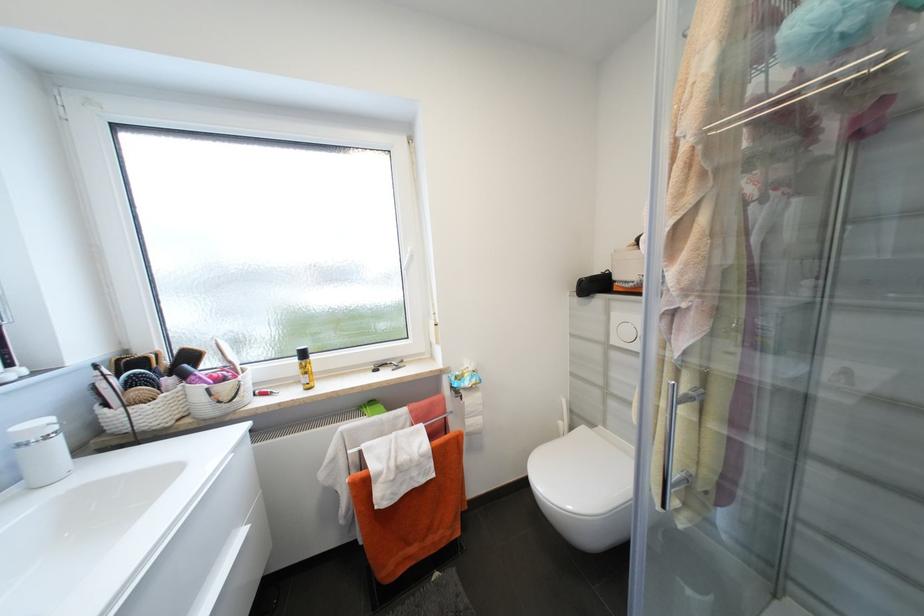
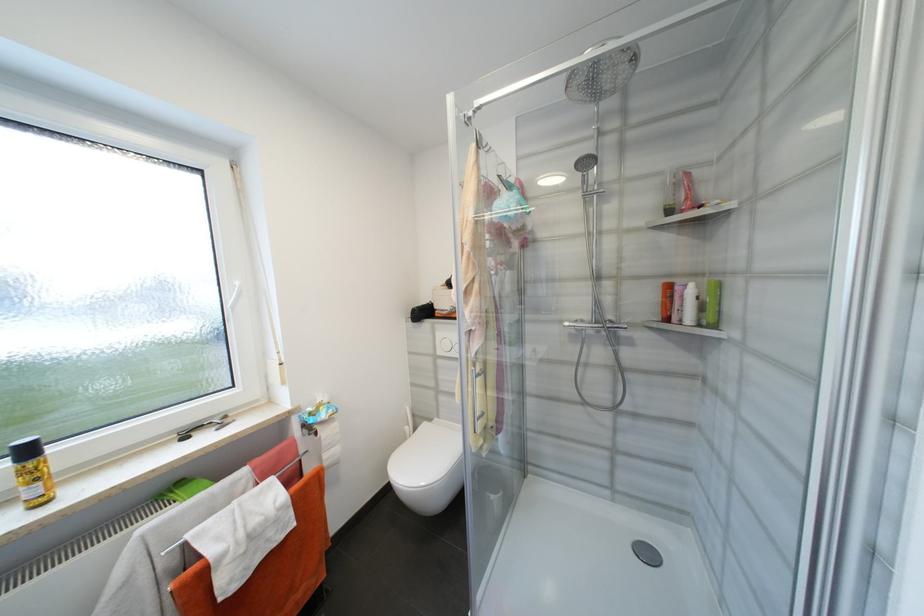
In the second image, find the point that corresponds to point 468,399 in the first image.

(322, 435)